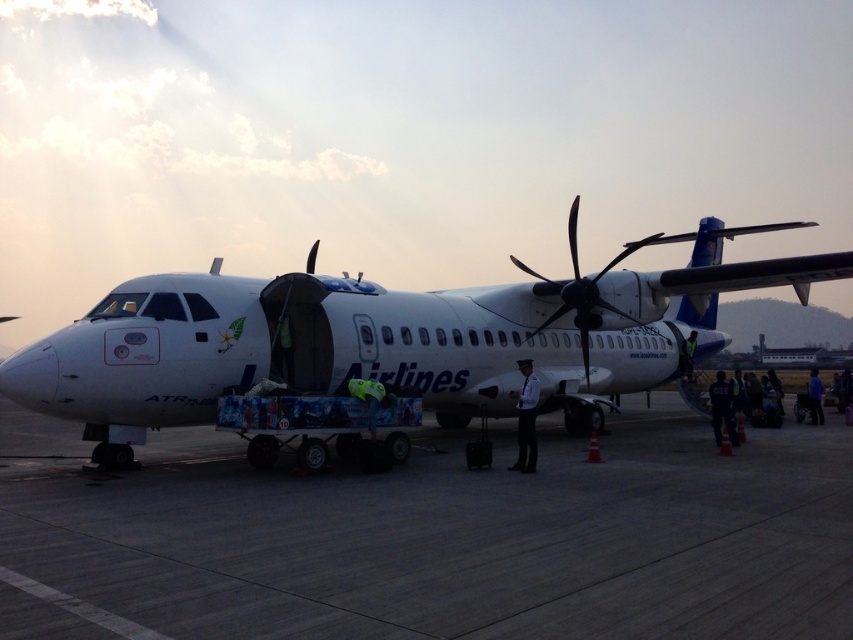
You are a maintenance worker at the airport and need to inspect the concrete tarmac at center and the black metallic propeller at center. From your vantage point, which object is closer to you?

The concrete tarmac at center is in front of the black metallic propeller at center, so the concrete tarmac at center is closer to you.

You are a pilot preparing to board the white matte airplane at center. As you walk from the terminal towards the airplane, you notice the concrete tarmac at center. Which object is larger in size?

The white matte airplane at center is larger than the concrete tarmac at center.

Consider the image. You are a maintenance worker who needs to inspect the distance between the concrete tarmac at center and the white matte airplane at center. According to safety regulations, the minimum distance required for safe inspection is 4 meters. Can you safely perform the inspection from the tarmac?

The concrete tarmac at center is 3.90 meters from the white matte airplane at center. Since the required minimum distance is 4 meters, the distance is insufficient, so the inspection cannot be safely performed from the tarmac.